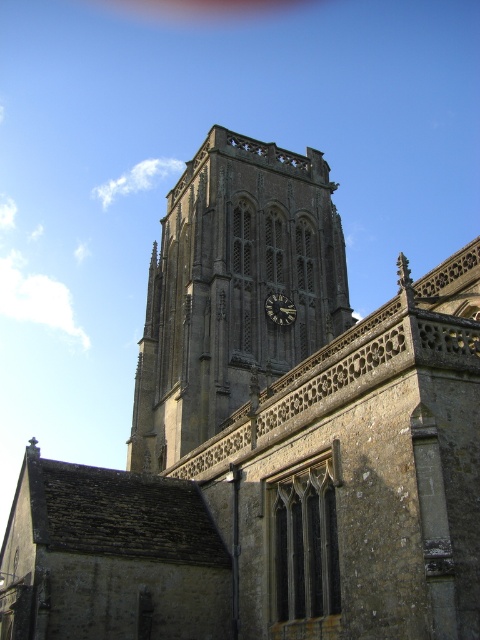
Question: Is brown stone clock tower at center positioned behind dark gray stone clock at center?

Choices:
 (A) yes
 (B) no

Answer: (B)

Question: Can you confirm if brown stone clock tower at center is bigger than dark gray stone clock at center?

Choices:
 (A) yes
 (B) no

Answer: (A)

Question: Which point is farther from the camera taking this photo?

Choices:
 (A) (269, 317)
 (B) (181, 419)

Answer: (A)

Question: Which point is farther from the camera taking this photo?

Choices:
 (A) (347, 304)
 (B) (288, 320)

Answer: (A)

Question: Is brown stone clock tower at center to the right of dark gray stone clock at center from the viewer's perspective?

Choices:
 (A) yes
 (B) no

Answer: (B)

Question: Which of the following is the farthest from the observer?

Choices:
 (A) (213, 348)
 (B) (288, 317)

Answer: (B)